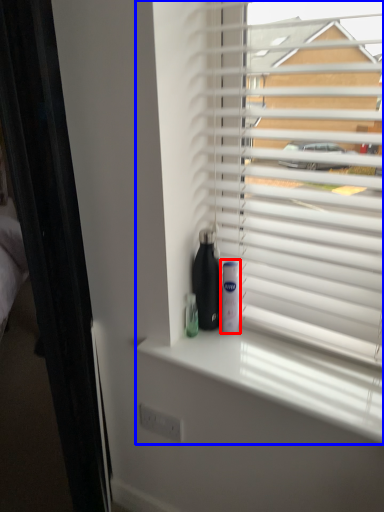
Question: Which object is further to the camera taking this photo, mouthwash (highlighted by a red box) or window blind (highlighted by a blue box)?

Choices:
 (A) mouthwash
 (B) window blind

Answer: (A)